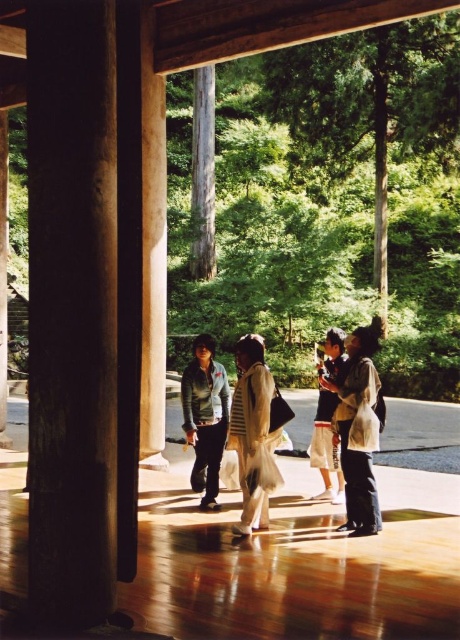
You are standing inside the wooden structure and want to exit towards the sunlight. There is a smooth wood pillar at left and a white textured coat at center. Which object is closer to you?

The smooth wood pillar at left is above the white textured coat at center, so the white textured coat at center is closer to you since it is below the pillar.

You are standing inside the wooden structure and see the matte gray jacket at center and the denim shorts at center. Which one is closer to you?

The matte gray jacket at center is closer to you since it is in front of the denim shorts at center.

You are standing inside the wooden structure and want to exit towards the sunlight. There is a smooth wood pillar at left and a white textured scarf at center. Which object is bigger in size?

The smooth wood pillar at left has a larger size compared to the white textured scarf at center, so the smooth wood pillar at left is bigger in size.